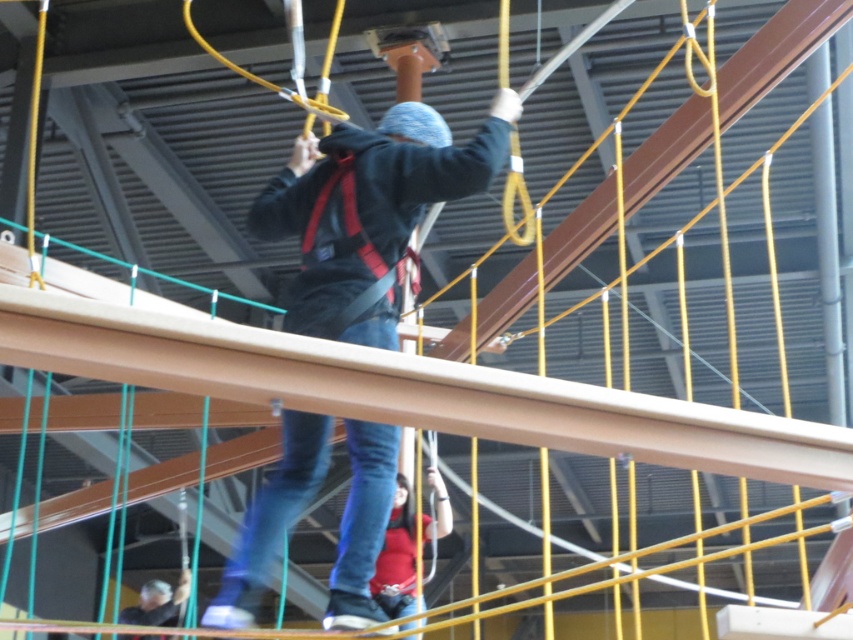
Who is shorter, brown metallic beam at center or dark blue fleece jacket at center?

brown metallic beam at center is shorter.

Which is above, brown metallic beam at center or dark blue fleece jacket at center?

dark blue fleece jacket at center is higher up.

Does point (676, 413) lie in front of point (317, 236)?

Yes.

Locate an element on the screen. This screenshot has width=853, height=640. brown metallic beam at center is located at coordinates (410, 390).

Between point (323, 618) and point (135, 618), which one is positioned behind?

The point (135, 618) is more distant.

Who is shorter, dark blue fleece jacket at center or dark gray fabric cap at lower left?

dark gray fabric cap at lower left is shorter.

Is point (438, 188) positioned before point (140, 596)?

Yes, point (438, 188) is in front of point (140, 596).

Where is `dark blue fleece jacket at center`? dark blue fleece jacket at center is located at coordinates (369, 211).

Does matte red shirt at lower center have a greater width compared to dark gray fabric cap at lower left?

No.

Which is above, matte red shirt at lower center or dark gray fabric cap at lower left?

Positioned higher is matte red shirt at lower center.

Between point (381, 566) and point (132, 611), which one is positioned behind?

Point (132, 611)

Where is `matte red shirt at lower center`? This screenshot has width=853, height=640. matte red shirt at lower center is located at coordinates (397, 556).